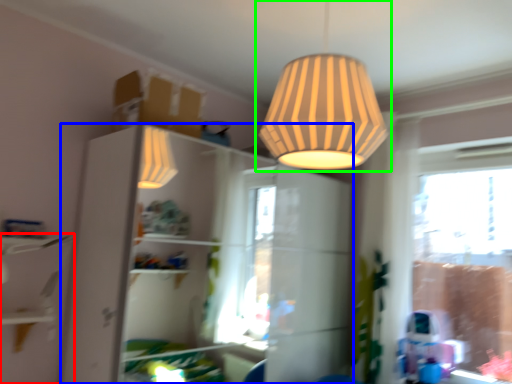
Question: Estimate the real-world distances between objects in this image. Which object is closer to shelf (highlighted by a red box), dresser (highlighted by a blue box) or lamp (highlighted by a green box)?

Choices:
 (A) dresser
 (B) lamp

Answer: (B)